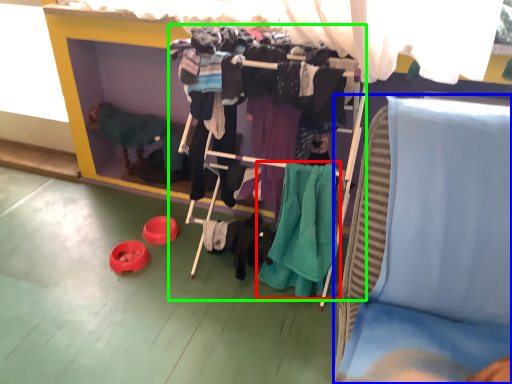
Question: Considering the real-world distances, which object is closest to clothing (highlighted by a red box)? furniture (highlighted by a blue box) or closet (highlighted by a green box).

Choices:
 (A) furniture
 (B) closet

Answer: (B)